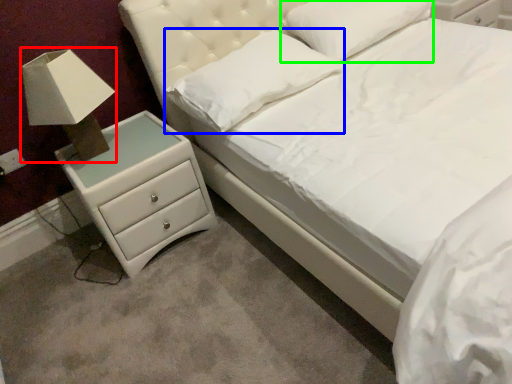
Question: Which object is the closest to the table lamp (highlighted by a red box)? Choose among these: pillow (highlighted by a blue box) or pillow (highlighted by a green box).

Choices:
 (A) pillow
 (B) pillow

Answer: (A)